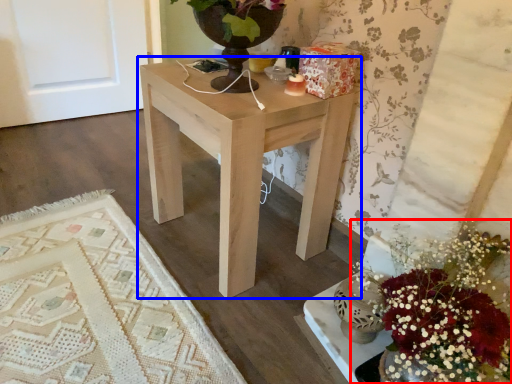
Question: Which object appears closest to the camera in this image, flower (highlighted by a red box) or table (highlighted by a blue box)?

Choices:
 (A) flower
 (B) table

Answer: (A)